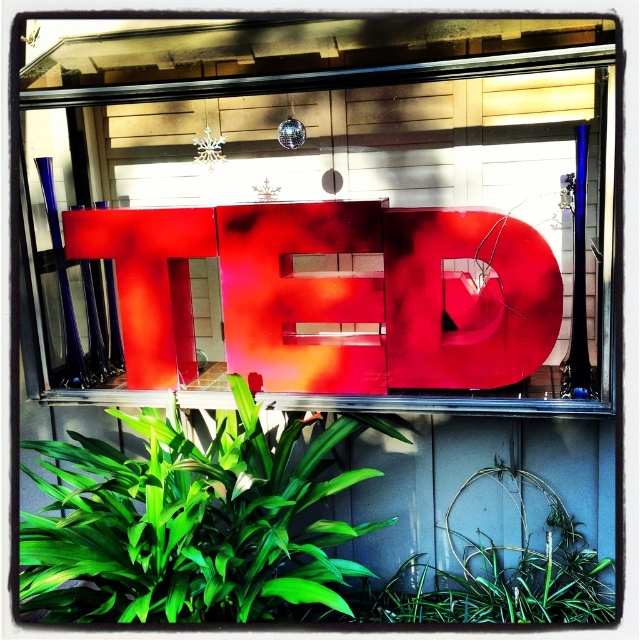
You are standing in front of the TED display and want to place a small gift between the glossy plastic letter at center and the green leafy plant at lower center. Can you fit it there?

The glossy plastic letter at center is to the left of green leafy plant at lower center, so there is space between them to place the small gift.

You are standing in front of the display and want to touch the glossy plastic letter at center and the green leafy plant at lower center. Which object will require you to reach further away from your body?

The green leafy plant at lower center requires reaching further away from your body because the glossy plastic letter at center is closer to the viewer.